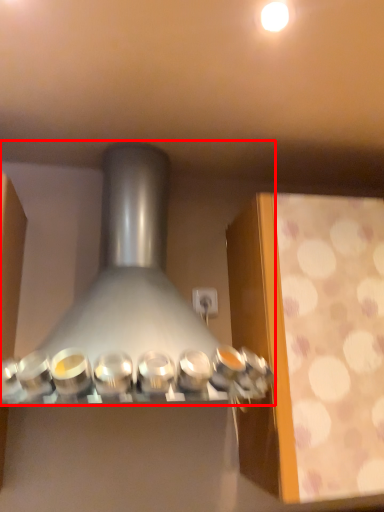
Question: From the image's perspective, where is kitchen appliance (annotated by the red box) located in relation to lighting in the image?

Choices:
 (A) above
 (B) below

Answer: (B)